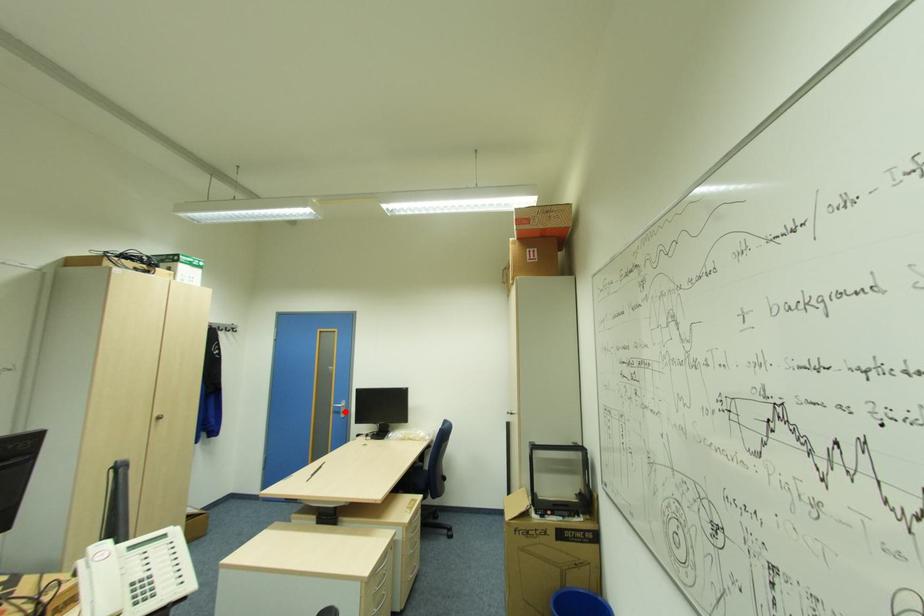
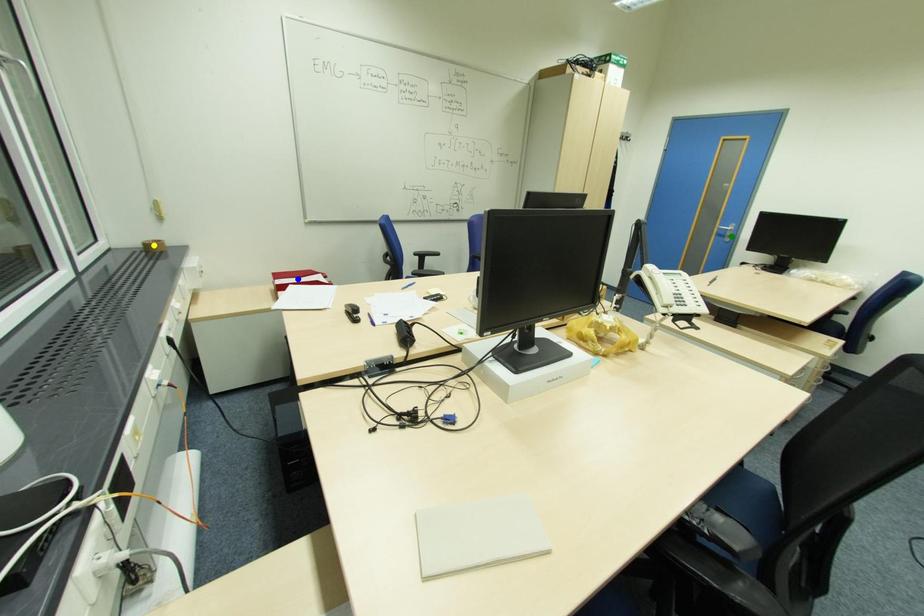
Question: I am providing you with two images of the same scene from different viewpoints. A red point is marked on the first image. You are given multiple points on the second image. Which point in image 2 is actually the same real-world point as the red point in image 1?

Choices:
 (A) blue point
 (B) green point
 (C) yellow point

Answer: (B)